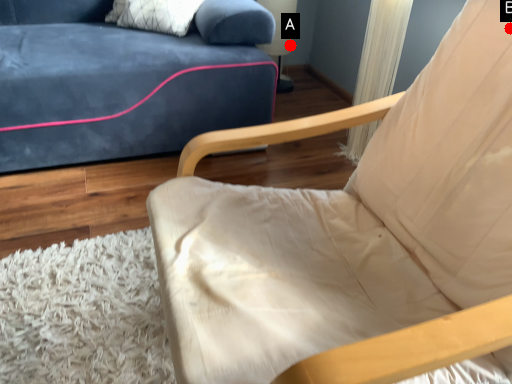
Question: Two points are circled on the image, labeled by A and B beside each circle. Which of the following is the farthest from the observer?

Choices:
 (A) A is further
 (B) B is further

Answer: (A)